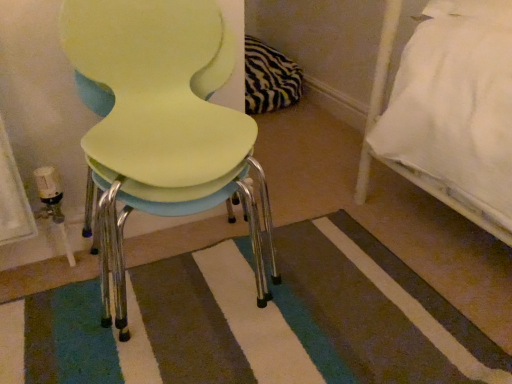
What do you see at coordinates (162, 123) in the screenshot? The image size is (512, 384). I see `matte yellow chair at center` at bounding box center [162, 123].

In order to face matte yellow chair at center, should I rotate leftwards or rightwards?

To face it directly, rotate left by 11.166 degrees.

At what (x,y) coordinates should I click in order to perform the action: click on matte yellow chair at center. Please return your answer as a coordinate pair (x, y). This screenshot has width=512, height=384. Looking at the image, I should click on (162, 123).

Measure the distance between striped carpet at center and camera.

striped carpet at center and camera are 31.04 inches apart from each other.

The image size is (512, 384). Find the location of `striped carpet at center`. striped carpet at center is located at coordinates (263, 321).

What do you see at coordinates (263, 321) in the screenshot? I see `striped carpet at center` at bounding box center [263, 321].

Find the location of a particular element. The image size is (512, 384). matte yellow chair at center is located at coordinates (162, 123).

Is striped carpet at center to the left of matte yellow chair at center from the viewer's perspective?

Incorrect, striped carpet at center is not on the left side of matte yellow chair at center.

Considering the relative positions of striped carpet at center and matte yellow chair at center in the image provided, is striped carpet at center in front of matte yellow chair at center?

No, it is behind matte yellow chair at center.

Which point is more forward, (339, 320) or (170, 134)?

The point (170, 134) is more forward.

From the image's perspective, is striped carpet at center below matte yellow chair at center?

Indeed, from the image's perspective, striped carpet at center is shown beneath matte yellow chair at center.

From a real-world perspective, is striped carpet at center positioned above or below matte yellow chair at center?

In terms of real-world spatial position, striped carpet at center is below matte yellow chair at center.

Is striped carpet at center wider or thinner than matte yellow chair at center?

Considering their sizes, striped carpet at center looks broader than matte yellow chair at center.

In the scene shown: Who is taller, striped carpet at center or matte yellow chair at center?

matte yellow chair at center.

Which of these two, striped carpet at center or matte yellow chair at center, is smaller?

striped carpet at center.

Is striped carpet at center spatially inside matte yellow chair at center, or outside of it?

striped carpet at center is outside matte yellow chair at center.

Are striped carpet at center and matte yellow chair at center making contact?

There is a gap between striped carpet at center and matte yellow chair at center.

Is striped carpet at center facing towards matte yellow chair at center?

No, striped carpet at center is not facing towards matte yellow chair at center.

How many degrees apart are the facing directions of striped carpet at center and matte yellow chair at center?

They differ by 89 degrees in their facing directions.

How distant is striped carpet at center from matte yellow chair at center?

striped carpet at center and matte yellow chair at center are 32.76 centimeters apart.

Locate an element on the screen. mat lying behind the matte yellow chair at center is located at coordinates (263, 321).

In the scene shown: Is matte yellow chair at center to the left of striped carpet at center from the viewer's perspective?

Correct, you'll find matte yellow chair at center to the left of striped carpet at center.

In the scene shown: Is the depth of matte yellow chair at center less than that of striped carpet at center?

Yes, matte yellow chair at center is closer to the camera.

Which is closer to the camera, [228,165] or [84,372]?

The point [228,165] is more forward.

From the image's perspective, which is above, matte yellow chair at center or striped carpet at center?

matte yellow chair at center is shown above in the image.

From a real-world perspective, between matte yellow chair at center and striped carpet at center, who is vertically higher?

matte yellow chair at center, from a real-world perspective.

Does matte yellow chair at center have a lesser width compared to striped carpet at center?

Indeed, matte yellow chair at center has a lesser width compared to striped carpet at center.

Who is taller, matte yellow chair at center or striped carpet at center?

Standing taller between the two is matte yellow chair at center.

Who is bigger, matte yellow chair at center or striped carpet at center?

matte yellow chair at center is bigger.

Is matte yellow chair at center not inside striped carpet at center?

Yes, matte yellow chair at center is located beyond the bounds of striped carpet at center.

Is matte yellow chair at center in contact with striped carpet at center?

They are not placed beside each other.

Is matte yellow chair at center aimed at striped carpet at center?

No, matte yellow chair at center is not aimed at striped carpet at center.

This screenshot has height=384, width=512. I want to click on mat below the matte yellow chair at center (from a real-world perspective), so click(263, 321).

This screenshot has height=384, width=512. I want to click on chair above the striped carpet at center (from a real-world perspective), so click(162, 123).

At what (x,y) coordinates should I click in order to perform the action: click on chair that is on the left side of striped carpet at center. Please return your answer as a coordinate pair (x, y). Looking at the image, I should click on (162, 123).